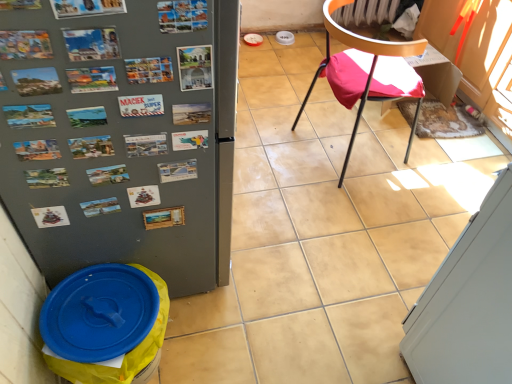
This screenshot has height=384, width=512. Find the location of `vacant space to the right of metallic black chair at center right`. vacant space to the right of metallic black chair at center right is located at coordinates (430, 163).